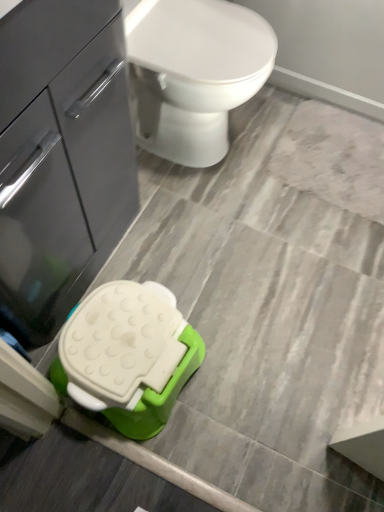
What do you see at coordinates (61, 158) in the screenshot? The width and height of the screenshot is (384, 512). I see `matte gray cabinet at left` at bounding box center [61, 158].

What is the approximate width of matte gray cabinet at left?

matte gray cabinet at left is 17.12 inches wide.

Where is `matte gray cabinet at left`? The image size is (384, 512). matte gray cabinet at left is located at coordinates (61, 158).

Where is `white glossy toilet at upper center`? The width and height of the screenshot is (384, 512). white glossy toilet at upper center is located at coordinates click(194, 73).

The image size is (384, 512). What do you see at coordinates (194, 73) in the screenshot?
I see `white glossy toilet at upper center` at bounding box center [194, 73].

Locate an element on the screen. Image resolution: width=384 pixels, height=512 pixels. matte gray cabinet at left is located at coordinates (61, 158).

Would you say white glossy toilet at upper center is to the left or to the right of matte gray cabinet at left in the picture?

Clearly, white glossy toilet at upper center is on the right of matte gray cabinet at left in the image.

Between white glossy toilet at upper center and matte gray cabinet at left, which one is positioned in front?

Positioned in front is matte gray cabinet at left.

Is point (243, 31) in front of point (26, 150)?

No, it is behind (26, 150).

From the image's perspective, is white glossy toilet at upper center located above or below matte gray cabinet at left?

white glossy toilet at upper center is situated higher than matte gray cabinet at left in the image.

From a real-world perspective, between white glossy toilet at upper center and matte gray cabinet at left, who is vertically higher?

From a 3D spatial view, matte gray cabinet at left is above.

Which of these two, white glossy toilet at upper center or matte gray cabinet at left, is thinner?

matte gray cabinet at left.

Does white glossy toilet at upper center have a greater height compared to matte gray cabinet at left?

No.

In terms of size, does white glossy toilet at upper center appear bigger or smaller than matte gray cabinet at left?

Clearly, white glossy toilet at upper center is smaller in size than matte gray cabinet at left.

Choose the correct answer: Is white glossy toilet at upper center inside matte gray cabinet at left or outside it?

white glossy toilet at upper center is spatially situated outside matte gray cabinet at left.

Is the surface of white glossy toilet at upper center in direct contact with matte gray cabinet at left?

white glossy toilet at upper center and matte gray cabinet at left are not in contact.

Is white glossy toilet at upper center looking in the opposite direction of matte gray cabinet at left?

That's not correct — white glossy toilet at upper center is not looking away from matte gray cabinet at left.

In the image, there is a matte gray cabinet at left. Where is `toilet below it (from a real-world perspective)`? This screenshot has height=512, width=384. toilet below it (from a real-world perspective) is located at coordinates (194, 73).

Considering the positions of objects matte gray cabinet at left and white glossy toilet at upper center in the image provided, who is more to the left, matte gray cabinet at left or white glossy toilet at upper center?

matte gray cabinet at left is more to the left.

Between matte gray cabinet at left and white glossy toilet at upper center, which one is positioned behind?

white glossy toilet at upper center is further from the camera.

Which is less distant, (110, 198) or (157, 80)?

Point (110, 198) appears to be closer to the viewer than point (157, 80).

From the image's perspective, is matte gray cabinet at left located above white glossy toilet at upper center?

No, from the image's perspective, matte gray cabinet at left is not on top of white glossy toilet at upper center.

Consider the image. From a real-world perspective, is matte gray cabinet at left below white glossy toilet at upper center?

Actually, matte gray cabinet at left is physically above white glossy toilet at upper center in the real world.

Which object is thinner, matte gray cabinet at left or white glossy toilet at upper center?

matte gray cabinet at left is thinner.

Which of these two, matte gray cabinet at left or white glossy toilet at upper center, stands shorter?

white glossy toilet at upper center.

Considering the sizes of objects matte gray cabinet at left and white glossy toilet at upper center in the image provided, who is smaller, matte gray cabinet at left or white glossy toilet at upper center?

white glossy toilet at upper center is smaller.

Based on the photo, would you say white glossy toilet at upper center is part of matte gray cabinet at left's contents?

No, matte gray cabinet at left does not contain white glossy toilet at upper center.

Is matte gray cabinet at left far from white glossy toilet at upper center?

No, matte gray cabinet at left is not far from white glossy toilet at upper center.

Is white glossy toilet at upper center at the back of matte gray cabinet at left?

No, matte gray cabinet at left is not facing the opposite direction of white glossy toilet at upper center.

How different are the orientations of matte gray cabinet at left and white glossy toilet at upper center in degrees?

There is a 0.61-degree angle between the facing directions of matte gray cabinet at left and white glossy toilet at upper center.

Locate an element on the screen. This screenshot has height=512, width=384. toilet lying behind the matte gray cabinet at left is located at coordinates (194, 73).

Where is `toilet on the right of matte gray cabinet at left`? The width and height of the screenshot is (384, 512). toilet on the right of matte gray cabinet at left is located at coordinates (194, 73).

Locate an element on the screen. This screenshot has height=512, width=384. toilet that appears above the matte gray cabinet at left (from the image's perspective) is located at coordinates (194, 73).